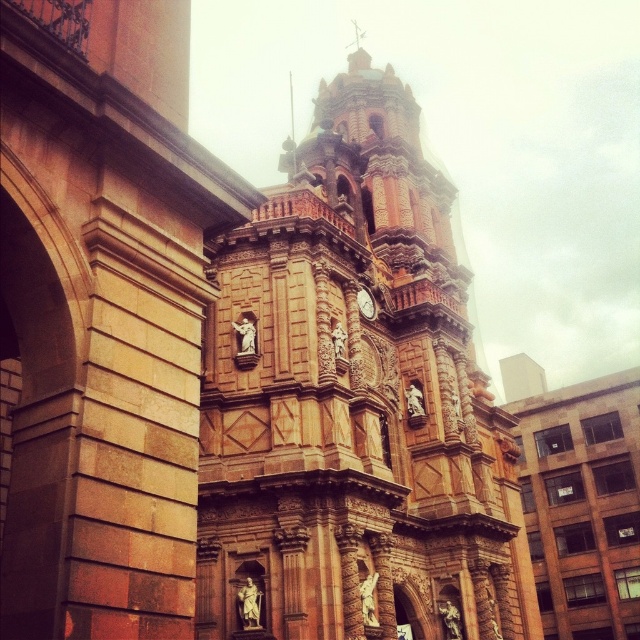
You are standing in front of the grand building and notice two central features. Which one is positioned to the left when observing the brown stone tower at center and the gold metallic clock at center?

The gold metallic clock at center is positioned to the left of the brown stone tower at center.

You are an architect planning to install a new decorative element on the brown stone tower at center and the gold metallic clock at center. Given their sizes, which one would require more materials for the new element?

The brown stone tower at center is bigger than the gold metallic clock at center, so it would require more materials for the new element.